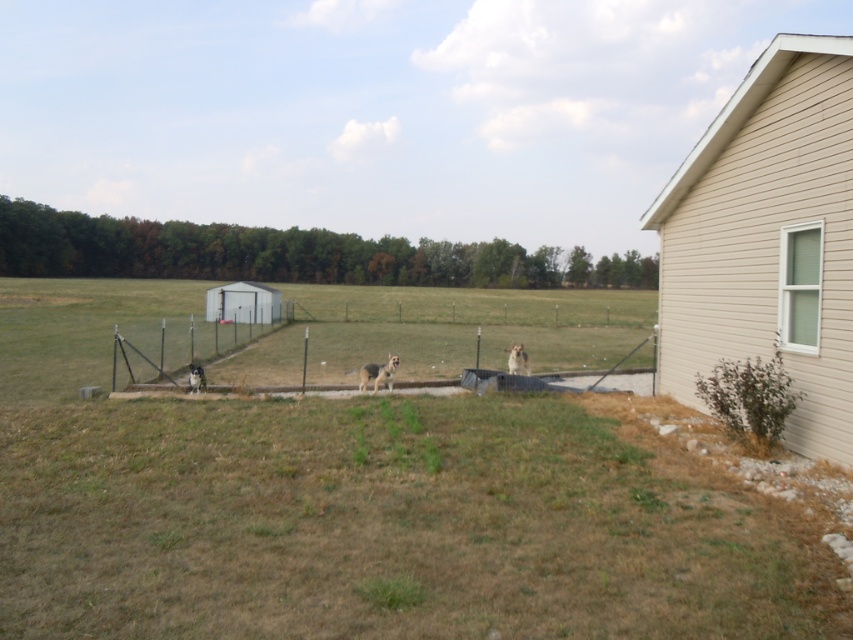
You are a drone operator trying to capture a photo of the fuzzy brown dog at center without the gray wire fence at center blocking the view. Based on the scene, can you position the drone in a way that the fence doesn not obscure the dog?

The gray wire fence at center is above the fuzzy brown dog at center, so positioning the drone slightly below the fence level would allow capturing the dog without the fence blocking the view.